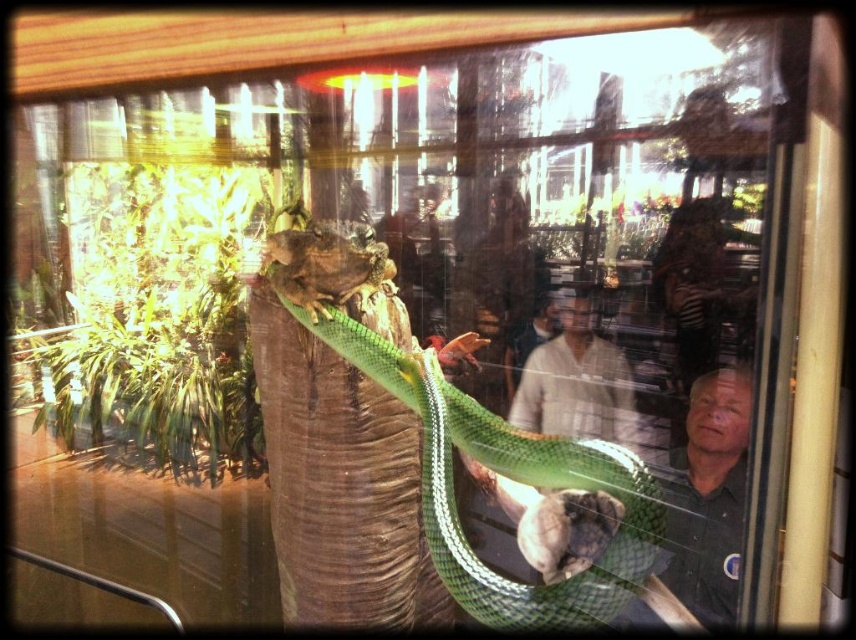
You are standing inside a building and looking through the window. There is a green glossy snake at center. Can you safely touch the snake without opening the window?

The green glossy snake at center is 3.71 feet away from you, so you can safely touch it without opening the window since it is within reach.